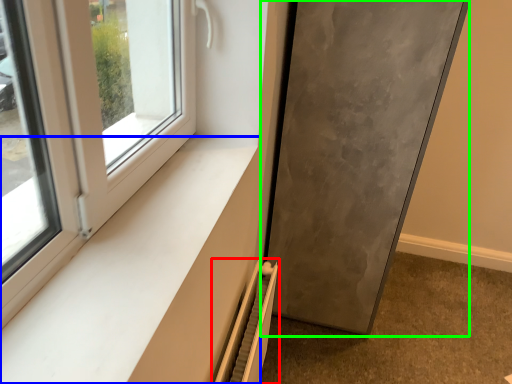
Question: Which is farther away from radiator (highlighted by a red box)? window sill (highlighted by a blue box) or door (highlighted by a green box)?

Choices:
 (A) window sill
 (B) door

Answer: (B)